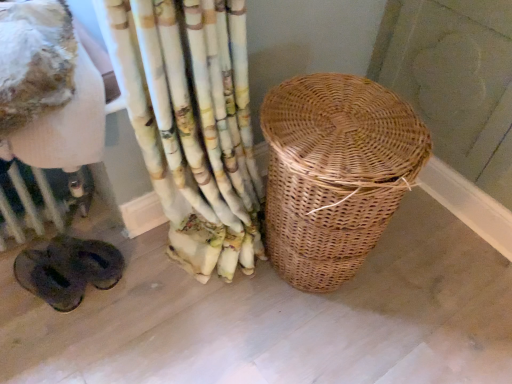
Find the location of a particular element. The image size is (512, 384). vacant region to the right of woven brown basket at center is located at coordinates (416, 280).